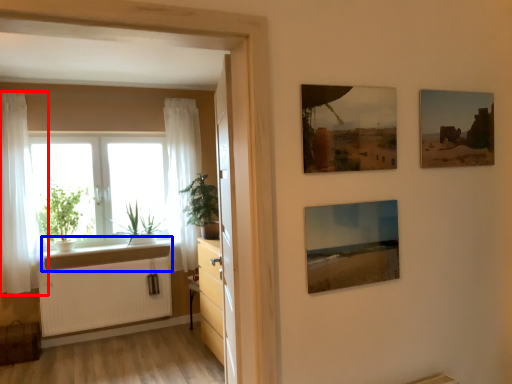
Question: Which point is further to the camera, curtain (highlighted by a red box) or window sill (highlighted by a blue box)?

Choices:
 (A) curtain
 (B) window sill

Answer: (B)